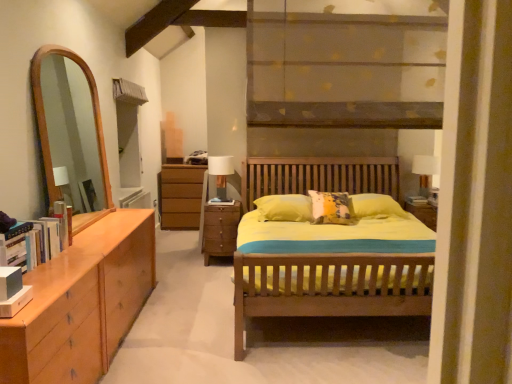
Question: Is point coord(331,72) closer or farther from the camera than point coord(422,163)?

Choices:
 (A) farther
 (B) closer

Answer: (B)

Question: Is matte brown wooden shelf at upper center taller or shorter than white glossy table lamp at right, positioned as the second table lamp in left-to-right order?

Choices:
 (A) short
 (B) tall

Answer: (B)

Question: Estimate the real-world distances between objects in this image. Which object is closer to the matte brown wooden shelf at upper center?

Choices:
 (A) matte white table lamp at center, arranged as the second table lamp when viewed from the right
 (B) white glossy table lamp at right, placed as the first table lamp when sorted from right to left
 (C) brown wooden chest of drawers at center

Answer: (A)

Question: Based on their relative distances, which object is nearer to the white glossy table lamp at right, placed as the first table lamp when sorted from right to left?

Choices:
 (A) matte white table lamp at center, arranged as the second table lamp when viewed from the right
 (B) matte brown wooden shelf at upper center
 (C) brown wooden chest of drawers at center

Answer: (A)